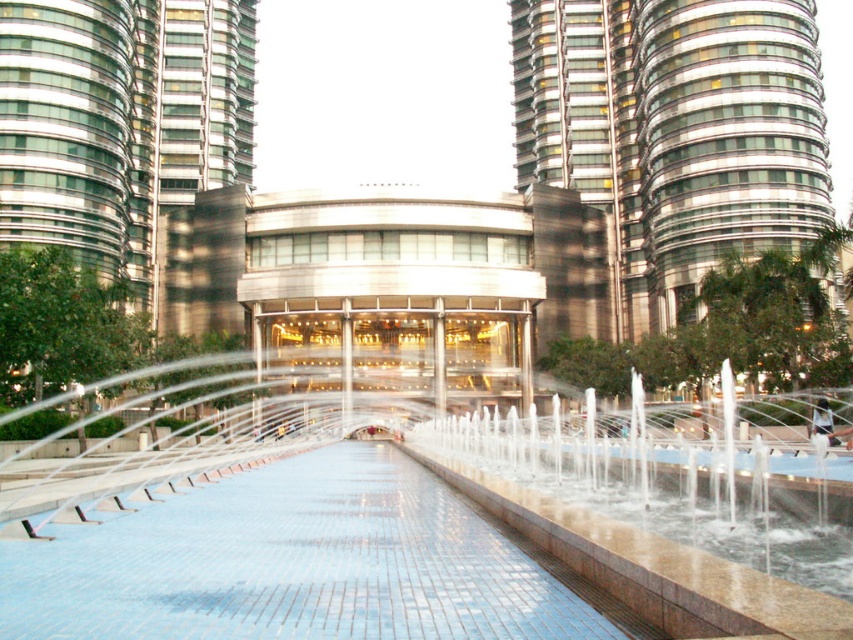
Question: Does white glossy water at center appear under glassy steel skyscraper at upper right?

Choices:
 (A) no
 (B) yes

Answer: (B)

Question: Can you confirm if white glossy water at center is smaller than glassy steel skyscraper at upper right?

Choices:
 (A) no
 (B) yes

Answer: (B)

Question: Which of the following is the farthest from the observer?

Choices:
 (A) white glossy water at center
 (B) glassy steel skyscraper at upper right

Answer: (B)

Question: Which point is closer to the camera?

Choices:
 (A) (10, 461)
 (B) (608, 148)

Answer: (A)

Question: Is white glossy water at center positioned at the back of glassy steel skyscraper at upper right?

Choices:
 (A) no
 (B) yes

Answer: (A)